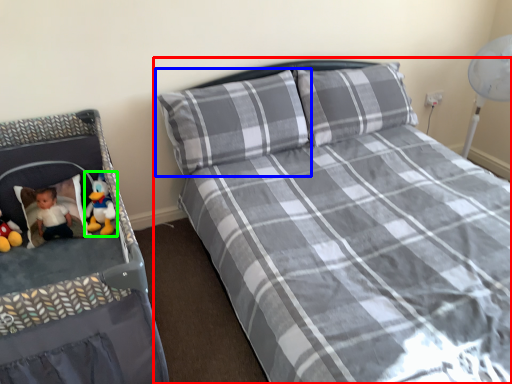
Question: Based on their relative distances, which object is farther from bed (highlighted by a red box)? Choose from pillow (highlighted by a blue box) and toy (highlighted by a green box).

Choices:
 (A) pillow
 (B) toy

Answer: (B)